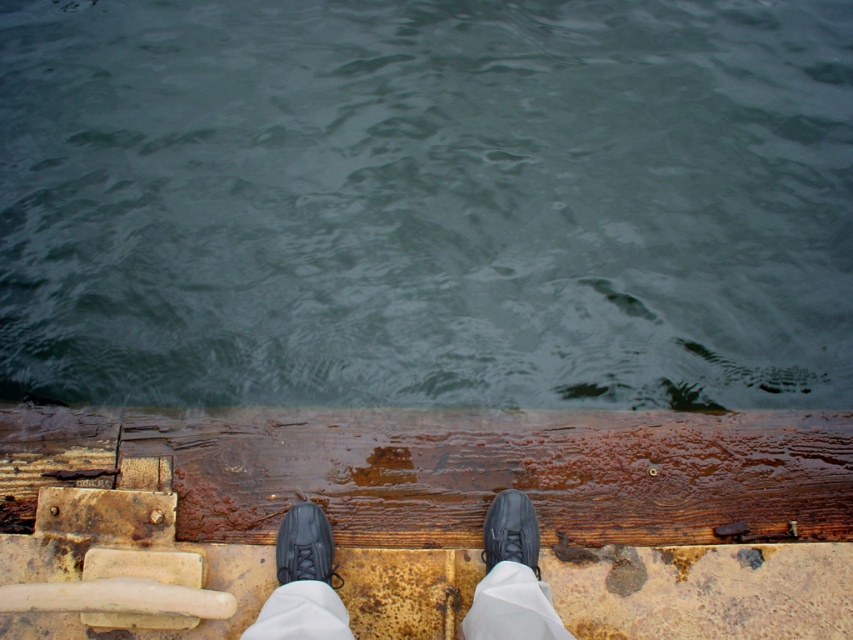
Question: Is green water at center below black leather shoe at lower center?

Choices:
 (A) yes
 (B) no

Answer: (B)

Question: Is rusty wood dock at center wider than black leather shoes at center?

Choices:
 (A) no
 (B) yes

Answer: (B)

Question: Which of the following is the closest to the observer?

Choices:
 (A) black leather shoes at center
 (B) black leather shoe at center
 (C) green water at center
 (D) rusty wood dock at center

Answer: (A)

Question: Is black leather shoes at center smaller than black leather shoe at center?

Choices:
 (A) yes
 (B) no

Answer: (B)

Question: Which point is farther from the camera taking this photo?

Choices:
 (A) (141, 355)
 (B) (495, 497)
 (C) (798, 448)
 (D) (326, 557)

Answer: (A)

Question: Which point is closer to the camera?

Choices:
 (A) black leather shoe at center
 (B) rusty wood dock at center
 (C) black leather shoes at center

Answer: (C)